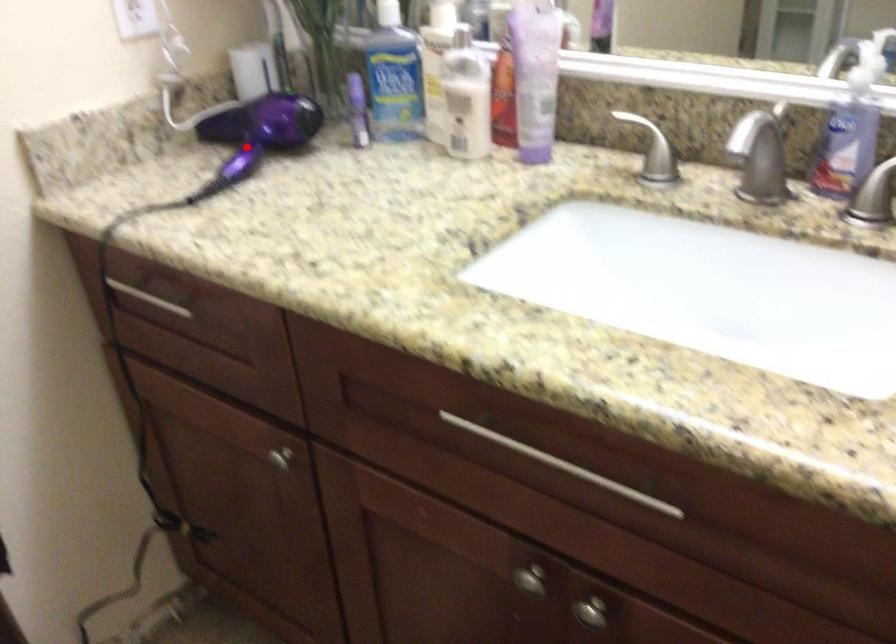
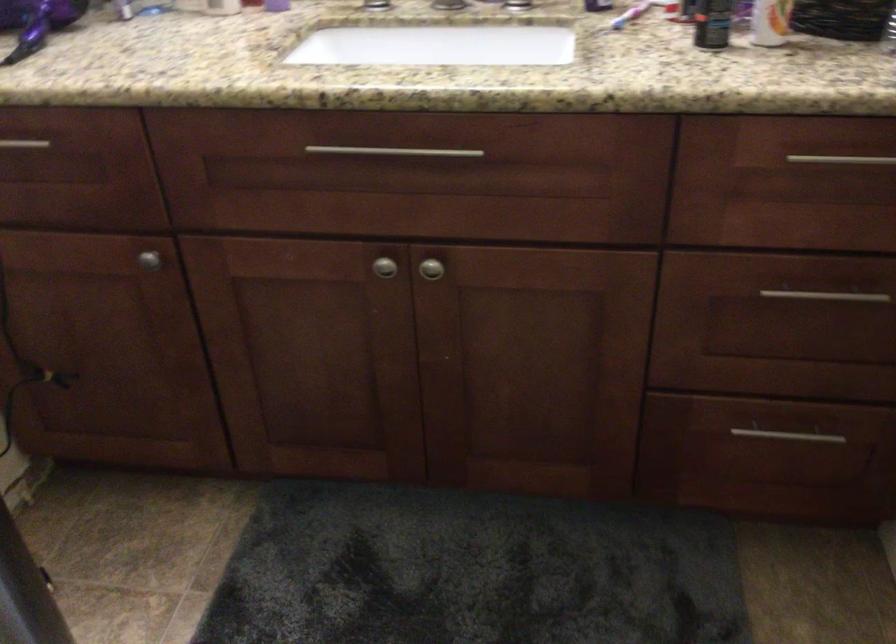
Question: I am providing you with two images of the same scene from different viewpoints. A red point is shown in image1. For the corresponding object point in image2, is it positioned nearer or farther from the camera?

Choices:
 (A) Nearer
 (B) Farther

Answer: (B)